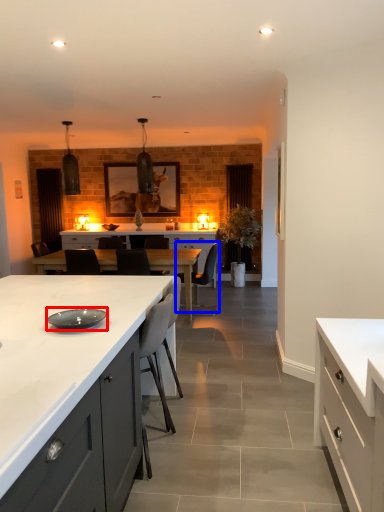
Question: Which point is further to the camera, plate (highlighted by a red box) or armchair (highlighted by a blue box)?

Choices:
 (A) plate
 (B) armchair

Answer: (B)